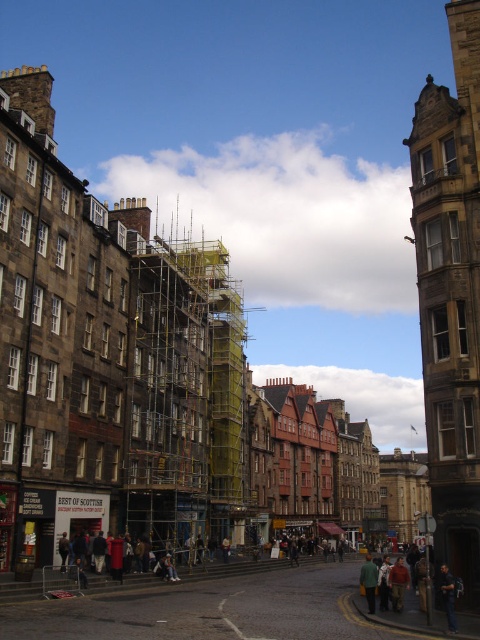
Question: Which point is farther to the camera?

Choices:
 (A) (372, 605)
 (B) (350, 566)

Answer: (B)

Question: Can you confirm if scaffolding at center is bigger than yellow fabric jacket at lower center?

Choices:
 (A) no
 (B) yes

Answer: (B)

Question: Can you confirm if yellow-green fabric scaffolding at center is positioned below yellow fabric jacket at lower center?

Choices:
 (A) no
 (B) yes

Answer: (A)

Question: Does scaffolding at center have a lesser width compared to yellow fabric jacket at lower center?

Choices:
 (A) no
 (B) yes

Answer: (A)

Question: Which is nearer to the scaffolding at center?

Choices:
 (A) yellow fabric jacket at lower center
 (B) yellow-green fabric scaffolding at center

Answer: (A)

Question: Among these objects, which one is farthest from the camera?

Choices:
 (A) scaffolding at center
 (B) yellow-green fabric scaffolding at center

Answer: (B)